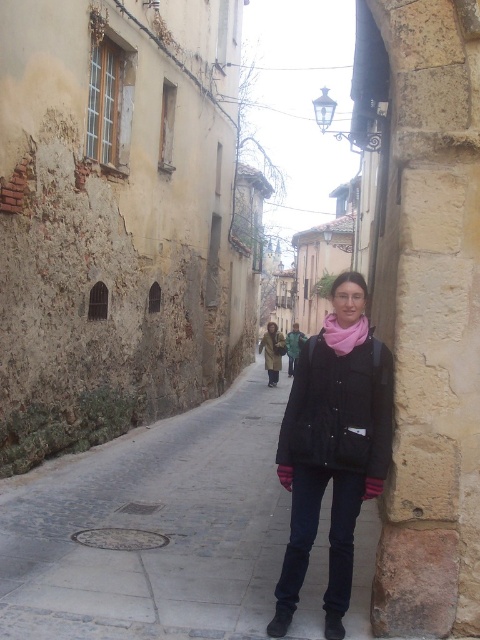
Question: Is pink soft scarf at center to the left of brown suede boot at lower center from the viewer's perspective?

Choices:
 (A) yes
 (B) no

Answer: (B)

Question: Which point is closer to the camera?

Choices:
 (A) (296, 477)
 (B) (361, 593)
 (C) (335, 330)

Answer: (C)

Question: Which object appears closest to the camera in this image?

Choices:
 (A) black matte jacket at center
 (B) matte brown coat at center
 (C) pink soft scarf at center

Answer: (A)

Question: Which point is closer to the camera?

Choices:
 (A) (133, 564)
 (B) (334, 321)
 (C) (278, 608)
 (D) (342, 609)

Answer: (C)

Question: Does brown suede boot at lower center come behind brown leather boot at lower center?

Choices:
 (A) yes
 (B) no

Answer: (A)

Question: Can you confirm if black matte jacket at center is thinner than pink soft scarf at center?

Choices:
 (A) yes
 (B) no

Answer: (A)